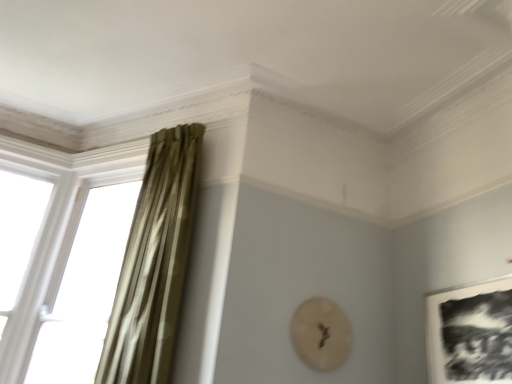
Find the location of a particular element. green velvet curtain at left is located at coordinates (154, 263).

Identify the location of translucent glass window at left. The height and width of the screenshot is (384, 512). (84, 287).

Is translucent glass window at left positioned beyond the bounds of black matte picture frame at lower right?

Yes, translucent glass window at left is not within black matte picture frame at lower right.

From the image's perspective, does translucent glass window at left appear higher than black matte picture frame at lower right?

Indeed, from the image's perspective, translucent glass window at left is shown above black matte picture frame at lower right.

Which object is further away from the camera taking this photo, translucent glass window at left or black matte picture frame at lower right?

translucent glass window at left.

Considering the relative sizes of black matte picture frame at lower right and green velvet curtain at left in the image provided, is black matte picture frame at lower right bigger than green velvet curtain at left?

No, black matte picture frame at lower right is not bigger than green velvet curtain at left.

Is point (494, 350) positioned behind point (122, 300)?

No.

Is black matte picture frame at lower right in front of green velvet curtain at left?

Yes.

Does black matte picture frame at lower right have a greater width compared to green velvet curtain at left?

No, black matte picture frame at lower right is not wider than green velvet curtain at left.

Is black matte picture frame at lower right facing towards translucent glass window at left?

No, black matte picture frame at lower right is not oriented towards translucent glass window at left.

Can you confirm if black matte picture frame at lower right is bigger than translucent glass window at left?

No.

Is point (488, 315) less distant than point (96, 211)?

Yes, point (488, 315) is in front of point (96, 211).

The width and height of the screenshot is (512, 384). I want to click on picture frame that is on the right side of translucent glass window at left, so click(x=471, y=333).

Between translucent glass window at left and green velvet curtain at left, which one has more height?

green velvet curtain at left.

From a real-world perspective, is translucent glass window at left physically located above or below green velvet curtain at left?

In terms of real-world spatial position, translucent glass window at left is below green velvet curtain at left.

Is translucent glass window at left looking in the opposite direction of green velvet curtain at left?

That's not correct — translucent glass window at left is not looking away from green velvet curtain at left.

Considering the relative positions of translucent glass window at left and green velvet curtain at left in the image provided, is translucent glass window at left to the right of green velvet curtain at left from the viewer's perspective?

In fact, translucent glass window at left is to the left of green velvet curtain at left.

Is black matte picture frame at lower right inside green velvet curtain at left?

Actually, black matte picture frame at lower right is outside green velvet curtain at left.

Is the surface of green velvet curtain at left in direct contact with black matte picture frame at lower right?

No, green velvet curtain at left is not beside black matte picture frame at lower right.

Looking at the image, does green velvet curtain at left seem bigger or smaller compared to black matte picture frame at lower right?

Considering their sizes, green velvet curtain at left takes up more space than black matte picture frame at lower right.

Who is shorter, green velvet curtain at left or black matte picture frame at lower right?

Standing shorter between the two is black matte picture frame at lower right.

Locate an element on the screen. Image resolution: width=512 pixels, height=384 pixels. curtain on the right side of translucent glass window at left is located at coordinates (154, 263).

From the image's perspective, between green velvet curtain at left and translucent glass window at left, which one is located above?

From the image's view, green velvet curtain at left is above.

Is point (158, 298) positioned before point (112, 230)?

Yes, it is in front of point (112, 230).

Identify the location of window on the left of black matte picture frame at lower right. The width and height of the screenshot is (512, 384). (84, 287).

Where is `picture frame below the green velvet curtain at left (from the image's perspective)`? The width and height of the screenshot is (512, 384). picture frame below the green velvet curtain at left (from the image's perspective) is located at coordinates click(x=471, y=333).

When comparing their distances from green velvet curtain at left, does black matte picture frame at lower right or translucent glass window at left seem further?

The object further to green velvet curtain at left is black matte picture frame at lower right.

From the picture: From the image, which object appears to be nearer to black matte picture frame at lower right, green velvet curtain at left or translucent glass window at left?

green velvet curtain at left.

Considering their positions, is green velvet curtain at left positioned closer to translucent glass window at left than black matte picture frame at lower right?

green velvet curtain at left is closer to translucent glass window at left.

Estimate the real-world distances between objects in this image. Which object is further from green velvet curtain at left, translucent glass window at left or black matte picture frame at lower right?

black matte picture frame at lower right is positioned further to the anchor green velvet curtain at left.

Considering their positions, is translucent glass window at left positioned closer to black matte picture frame at lower right than green velvet curtain at left?

Among the two, green velvet curtain at left is located nearer to black matte picture frame at lower right.

When comparing their distances from translucent glass window at left, does black matte picture frame at lower right or green velvet curtain at left seem closer?

green velvet curtain at left lies closer to translucent glass window at left than the other object.

Where is `curtain between translucent glass window at left and black matte picture frame at lower right`? The width and height of the screenshot is (512, 384). curtain between translucent glass window at left and black matte picture frame at lower right is located at coordinates tap(154, 263).